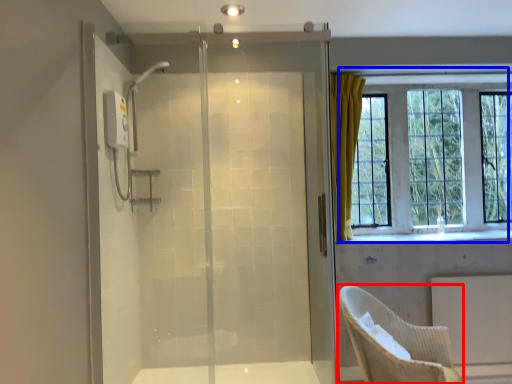
Question: Which point is closer to the camera, chair (highlighted by a red box) or window (highlighted by a blue box)?

Choices:
 (A) chair
 (B) window

Answer: (A)